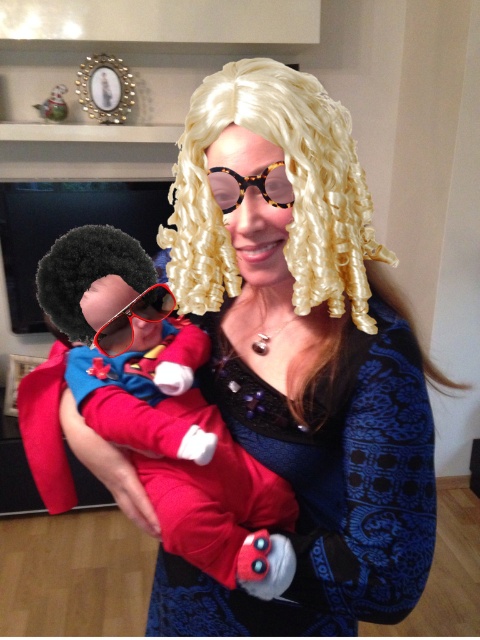
Locate an element on the screen. red fabric costume at left is located at coordinates (167, 413).

Can you confirm if red fabric costume at left is positioned below red plastic goggles at center?

Indeed, red fabric costume at left is positioned under red plastic goggles at center.

Image resolution: width=480 pixels, height=640 pixels. What do you see at coordinates (167, 413) in the screenshot?
I see `red fabric costume at left` at bounding box center [167, 413].

In order to click on red fabric costume at left in this screenshot , I will do `click(167, 413)`.

Which is in front, point (262, 67) or point (192, 324)?

Point (262, 67) is in front.

Find the location of a particular element. This screenshot has height=640, width=480. matte black wig at center is located at coordinates (300, 360).

Where is `matte black wig at center`? Image resolution: width=480 pixels, height=640 pixels. matte black wig at center is located at coordinates (300, 360).

Identify the location of matte black wig at center. The image size is (480, 640). (300, 360).

Looking at this image, does matte black wig at center have a larger size compared to red plastic goggles at center?

Correct, matte black wig at center is larger in size than red plastic goggles at center.

Does matte black wig at center come in front of red plastic goggles at center?

That is True.

Image resolution: width=480 pixels, height=640 pixels. I want to click on matte black wig at center, so click(x=300, y=360).

Find the location of a particular element. This screenshot has height=640, width=480. matte black wig at center is located at coordinates (300, 360).